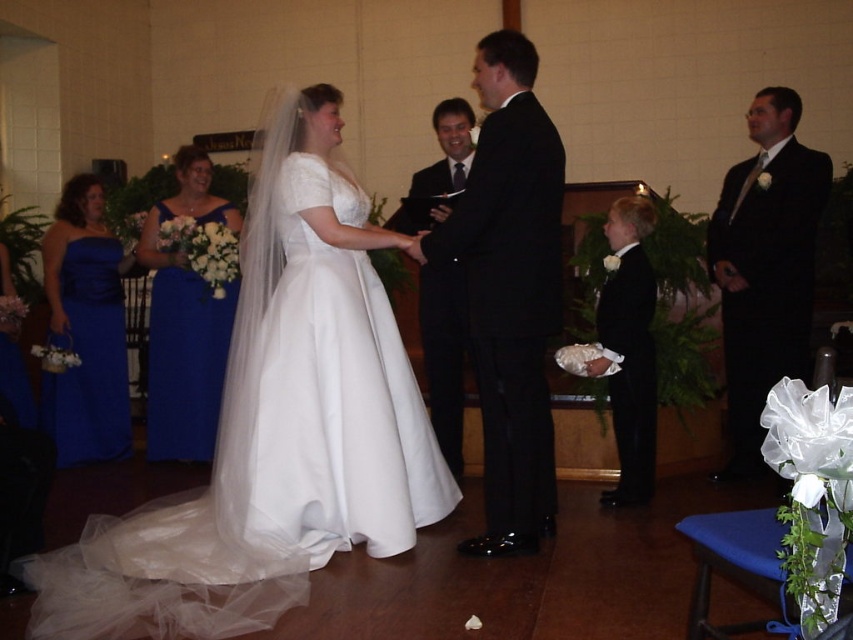
Question: Is shiny black suit at center positioned behind black satin suit at right?

Choices:
 (A) yes
 (B) no

Answer: (B)

Question: Among these points, which one is farthest from the camera?

Choices:
 (A) (538, 163)
 (B) (442, 308)

Answer: (B)

Question: Is the position of blue satin dress at left more distant than that of black satin suit at center?

Choices:
 (A) yes
 (B) no

Answer: (A)

Question: Can you confirm if shiny black suit at center is positioned above black satin suit at center?

Choices:
 (A) no
 (B) yes

Answer: (A)

Question: Which object is positioned farthest from the white satin dress at center?

Choices:
 (A) black satin suit at right
 (B) shiny black suit at center
 (C) black satin suit at lower right

Answer: (A)

Question: Which object is the farthest from the white satin dress at center?

Choices:
 (A) blue satin dress at left
 (B) shiny black suit at center

Answer: (A)